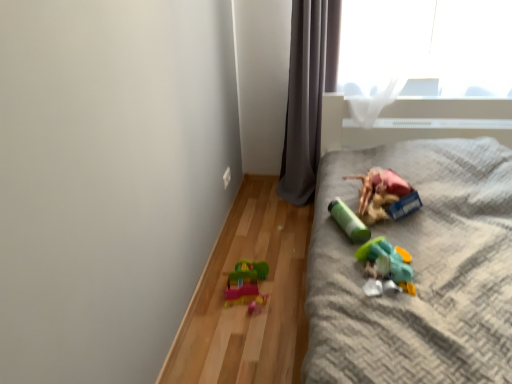
Locate an element on the screen. The width and height of the screenshot is (512, 384). vacant area that lies to the right of translucent plastic toy at lower left, acting as the fourth toy starting from the right is located at coordinates (290, 286).